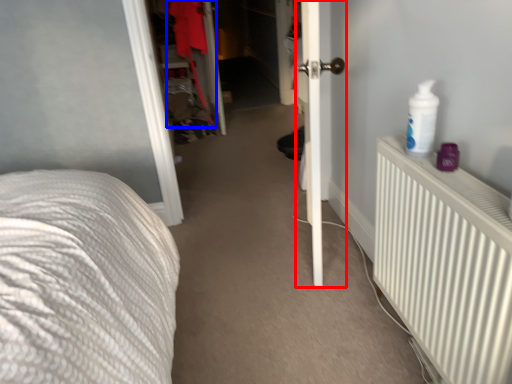
Question: Which point is closer to the camera, door (highlighted by a red box) or clothing (highlighted by a blue box)?

Choices:
 (A) door
 (B) clothing

Answer: (A)